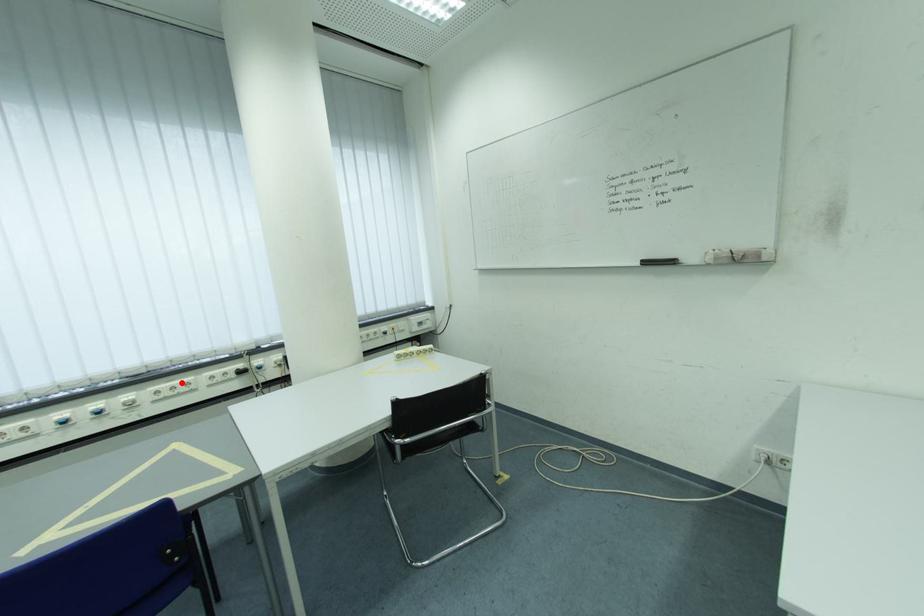
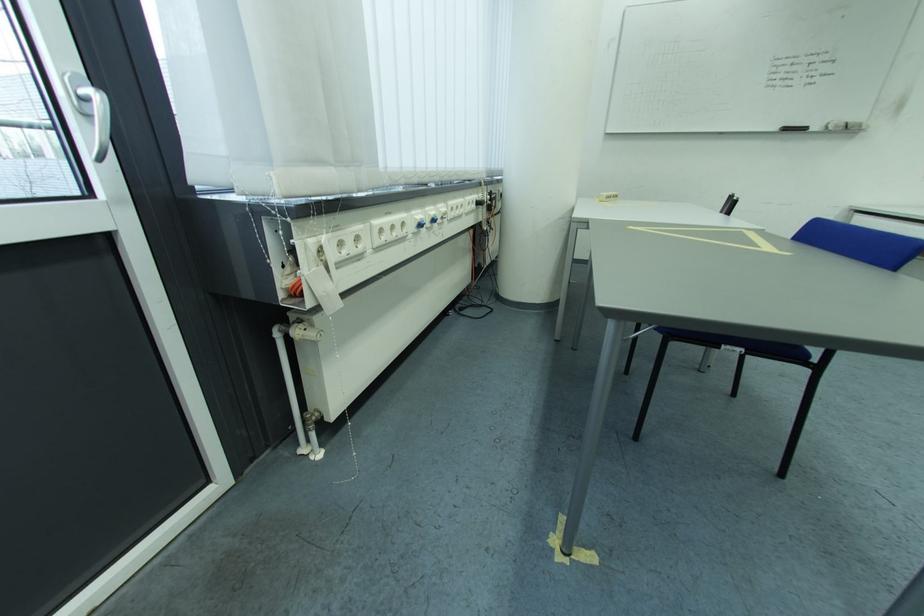
The point at the highlighted location is marked in the first image. Where is the corresponding point in the second image?

(465, 200)